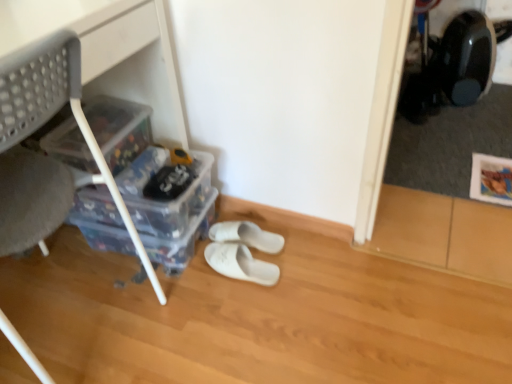
This screenshot has width=512, height=384. Identify the location of vacant area that lies between white plastic chair at left and transparent plastic storage box at lower left, the first storage box positioned from the bottom. (110, 265).